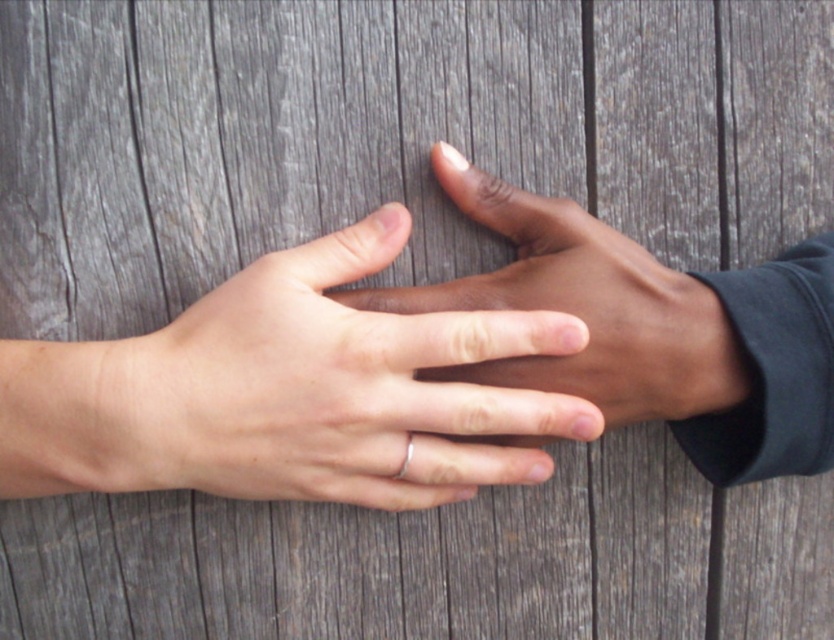
Question: Which point is farther to the camera?

Choices:
 (A) silver metallic ring at center
 (B) smooth skin hand at center

Answer: (B)

Question: Does matte silver ring at center have a greater width compared to silver metallic ring at center?

Choices:
 (A) no
 (B) yes

Answer: (B)

Question: Where is matte silver ring at center located in relation to smooth skin hand at center in the image?

Choices:
 (A) above
 (B) below

Answer: (B)

Question: Is matte silver ring at center bigger than silver metallic ring at center?

Choices:
 (A) yes
 (B) no

Answer: (A)

Question: Which of the following is the farthest from the observer?

Choices:
 (A) matte silver ring at center
 (B) smooth skin hand at center
 (C) silver metallic ring at center

Answer: (B)

Question: Which object is the closest to the matte silver ring at center?

Choices:
 (A) silver metallic ring at center
 (B) smooth skin hand at center

Answer: (B)